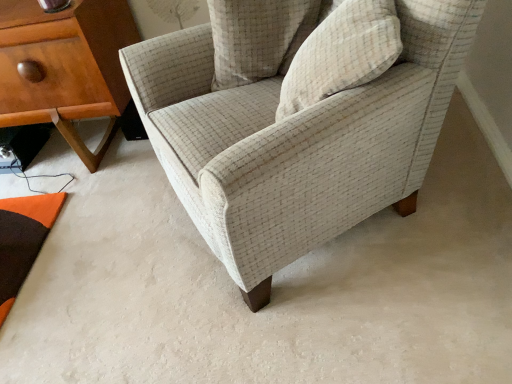
Question: In terms of width, does wooden nightstand at left look wider or thinner when compared to beige textured pillow at upper center, which is the 1th pillow in back-to-front order?

Choices:
 (A) thin
 (B) wide

Answer: (B)

Question: Is point (76, 99) positioned closer to the camera than point (278, 48)?

Choices:
 (A) farther
 (B) closer

Answer: (A)

Question: Which of these objects is positioned closest to the wooden nightstand at left?

Choices:
 (A) textured beige armchair at center
 (B) beige textured pillow at upper center, acting as the 2th pillow starting from the back
 (C) beige textured pillow at upper center, which is the 1th pillow in back-to-front order

Answer: (C)

Question: Which object is the closest to the textured beige armchair at center?

Choices:
 (A) wooden nightstand at left
 (B) beige textured pillow at upper center, marked as the first pillow in a front-to-back arrangement
 (C) beige textured pillow at upper center, placed as the second pillow when sorted from front to back

Answer: (B)